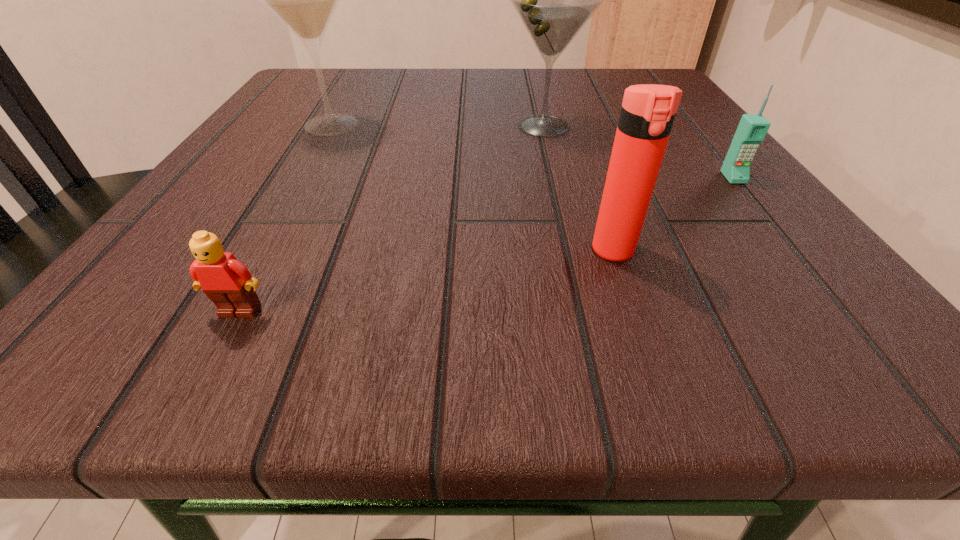
What are the coordinates of `vacant region located on the keypad of the second shortest object` in the screenshot? It's located at (872, 349).

Identify the location of object that is at the near edge. The width and height of the screenshot is (960, 540). (228, 283).

Identify the location of martini that is at the left edge. (304, 0).

What are the coordinates of `Lego at the left edge` in the screenshot? It's located at (228, 283).

Image resolution: width=960 pixels, height=540 pixels. What are the coordinates of `object at the right edge` in the screenshot? It's located at (752, 129).

The height and width of the screenshot is (540, 960). Identify the location of object that is at the far left corner. (304, 0).

I want to click on object that is at the near left corner, so click(228, 283).

Where is `free location at the far edge`? This screenshot has width=960, height=540. free location at the far edge is located at coordinates (563, 86).

The height and width of the screenshot is (540, 960). I want to click on vacant space at the near edge, so click(401, 321).

You are a GUI agent. You are given a task and a screenshot of the screen. Output one action in this format:
    pyautogui.click(x=<x>, y=<y>)
    Task: Click on the vacant space at the left edge of the desktop
    The height and width of the screenshot is (540, 960).
    Given the screenshot: What is the action you would take?
    pyautogui.click(x=222, y=195)